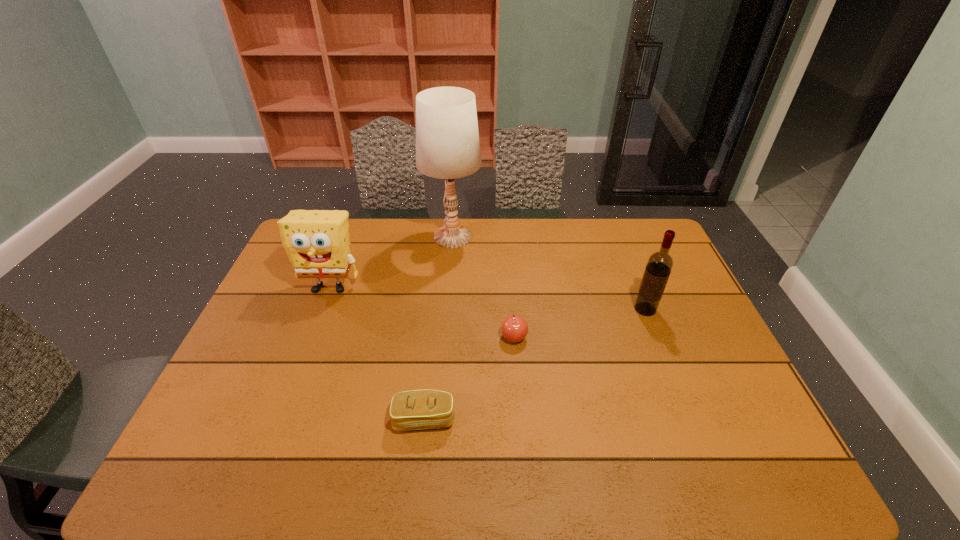
The image size is (960, 540). Identify the location of free location located on the face of the sponge. (319, 316).

The width and height of the screenshot is (960, 540). I want to click on free space located 0.200m on the front of the apple, so click(519, 411).

Locate an element on the screen. This screenshot has height=540, width=960. vacant area located on the zipper side of the shortest object is located at coordinates (418, 478).

This screenshot has height=540, width=960. I want to click on object that is at the far edge, so coord(447,138).

Find the location of a particular element. The image size is (960, 540). object located in the left edge section of the desktop is located at coordinates (317, 243).

Locate an element on the screen. This screenshot has width=960, height=540. object at the right edge is located at coordinates (659, 265).

Locate an element on the screen. The width and height of the screenshot is (960, 540). free space at the far edge of the desktop is located at coordinates (368, 240).

In the image, there is a desktop. At what (x,y) coordinates should I click in order to perform the action: click on vacant space at the near edge. Please return your answer as a coordinate pair (x, y). Looking at the image, I should click on (265, 482).

At what (x,y) coordinates should I click in order to perform the action: click on free space at the left edge. Please return your answer as a coordinate pair (x, y). Looking at the image, I should click on [249, 406].

Where is `blank space at the right edge of the desktop`? Image resolution: width=960 pixels, height=540 pixels. blank space at the right edge of the desktop is located at coordinates (696, 316).